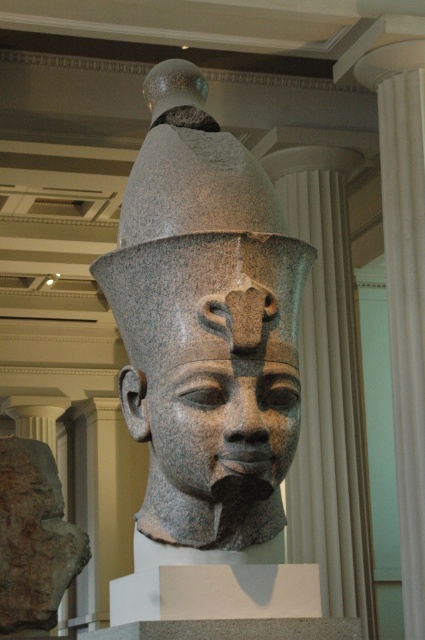
Which is behind, point (110, 307) or point (187, 483)?

The point (110, 307) is behind.

Who is more forward, (x=266, y=250) or (x=255, y=410)?

Point (x=255, y=410)

The image size is (425, 640). Identify the location of granite statue at center. (206, 328).

Does point (113, 269) come in front of point (408, 550)?

Yes, point (113, 269) is closer to viewer.

Where is `granite statue at center`? The width and height of the screenshot is (425, 640). granite statue at center is located at coordinates (206, 328).

Describe the element at coordinates (206, 328) in the screenshot. I see `granite statue at center` at that location.

At what (x,y) coordinates should I click in order to perform the action: click on granite statue at center. Please return your answer as a coordinate pair (x, y). The height and width of the screenshot is (640, 425). Looking at the image, I should click on (206, 328).

Does white marble column at right have a lesser height compared to granite statue head at center?

No, white marble column at right is not shorter than granite statue head at center.

Between point (399, 253) and point (217, 376), which one is positioned behind?

The point (399, 253) is behind.

Locate an element on the screen. This screenshot has width=425, height=640. white marble column at right is located at coordinates (405, 291).